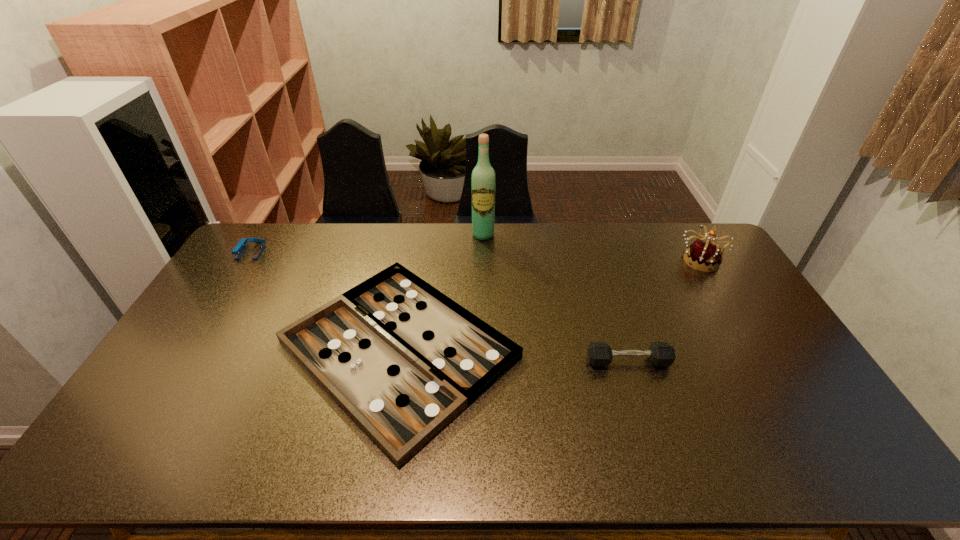
I want to click on wine bottle, so click(483, 181).

This screenshot has height=540, width=960. Identify the location of the tallest object. (483, 181).

Locate an element on the screen. This screenshot has height=540, width=960. the rightmost object is located at coordinates (705, 255).

Where is `tiara`? This screenshot has height=540, width=960. tiara is located at coordinates (705, 255).

Identify the location of the leftmost object. This screenshot has width=960, height=540. (238, 250).

Where is `the fourth tallest object`? the fourth tallest object is located at coordinates (599, 353).

Identify the location of dumbbell. (599, 353).

Locate an element on the screen. This screenshot has height=540, width=960. the shortest object is located at coordinates (402, 359).

Where is `free location located on the front-facing side of the wine bottle`? free location located on the front-facing side of the wine bottle is located at coordinates (484, 293).

Where is `vacant space located on the front-facing side of the rightmost object`? This screenshot has height=540, width=960. vacant space located on the front-facing side of the rightmost object is located at coordinates pyautogui.click(x=727, y=303).